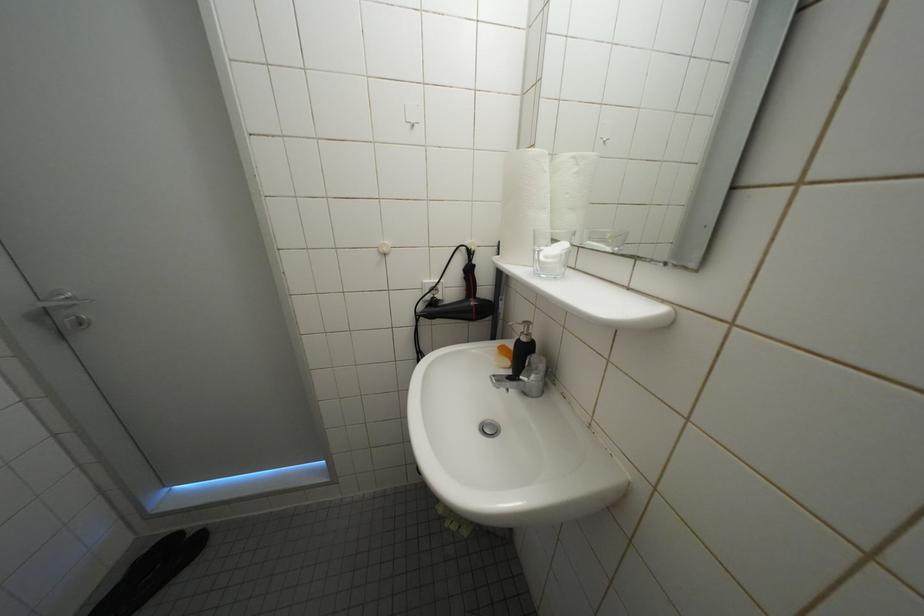
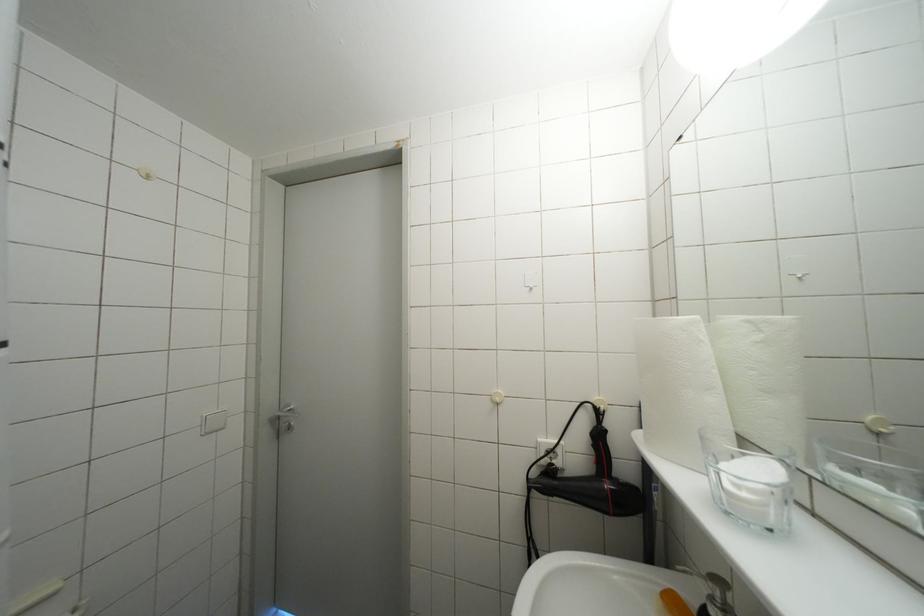
Based on the continuous images, in which direction is the camera rotating?

The camera rotated toward left-up.